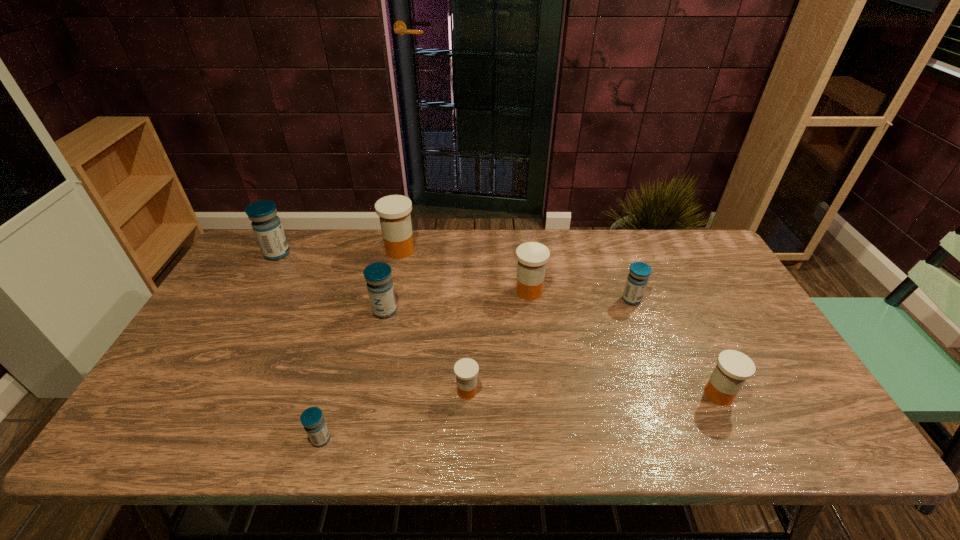
You are a GUI agent. You are given a task and a screenshot of the screen. Output one action in this format:
    pyautogui.click(x=<x>, y=<y>)
    Task: Click on the vacant position at the far left corner of the desktop
    The height and width of the screenshot is (540, 960).
    Given the screenshot: What is the action you would take?
    (x=276, y=266)

This screenshot has height=540, width=960. In the image, there is a desktop. What are the coordinates of `vacant space at the far right corner` in the screenshot? It's located at click(x=687, y=246).

Locate an element on the screen. The image size is (960, 540). free space at the near right corner of the desktop is located at coordinates (764, 443).

Where is `free space between the second biggest blue medicine and the rightmost orange medicine`? free space between the second biggest blue medicine and the rightmost orange medicine is located at coordinates (552, 353).

Where is `free point between the leftmost orange medicine and the seventh medicine from left to right`? The image size is (960, 540). free point between the leftmost orange medicine and the seventh medicine from left to right is located at coordinates (516, 275).

Identify the location of free space between the rightmost orange medicine and the third blue medicine from left to right. Image resolution: width=960 pixels, height=540 pixels. (552, 353).

The width and height of the screenshot is (960, 540). In order to click on vacant point located between the sixth object from left to right and the leftmost object in this screenshot , I will do `click(403, 273)`.

At what (x,y) coordinates should I click in order to perform the action: click on free spot between the biggest blue medicine and the rightmost object. Please return your answer as a coordinate pair (x, y). This screenshot has width=960, height=540. Looking at the image, I should click on (498, 324).

This screenshot has width=960, height=540. In order to click on unoccupied area between the third orange medicine from right to left and the third blue medicine from left to right in this screenshot , I will do `click(426, 351)`.

In order to click on vacant region between the second farthest orange medicine and the leftmost medicine in this screenshot , I will do `click(403, 273)`.